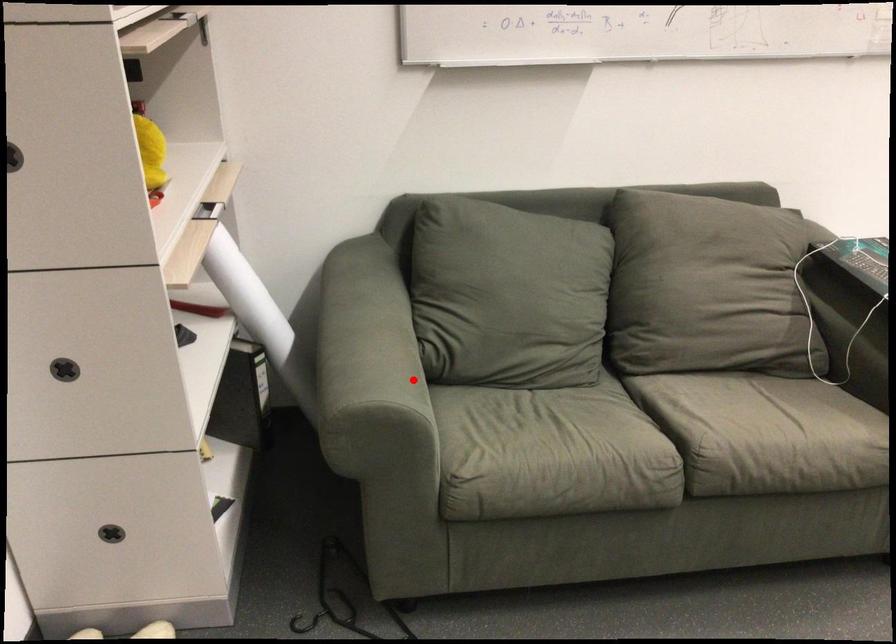
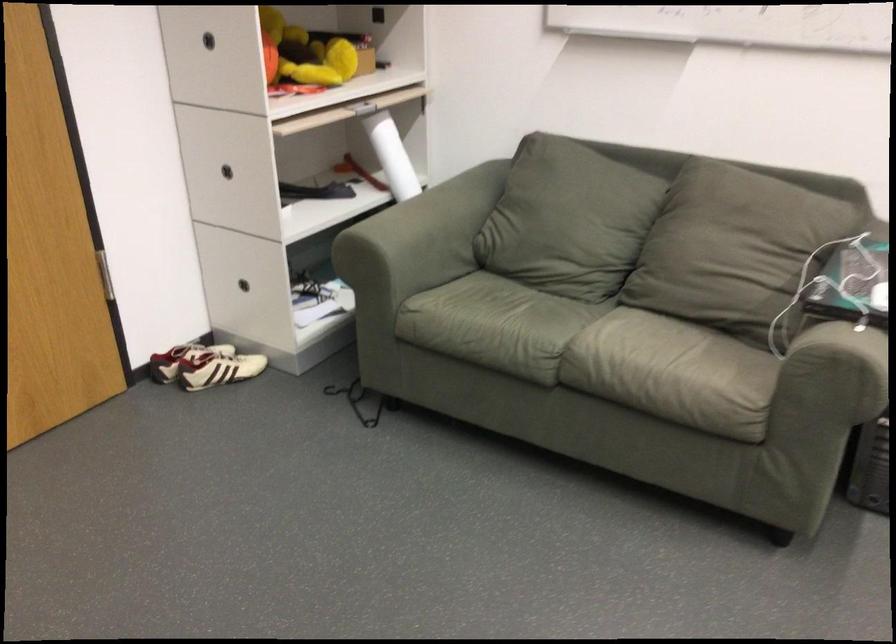
The point at the highlighted location is marked in the first image. Where is the corresponding point in the second image?

(416, 242)